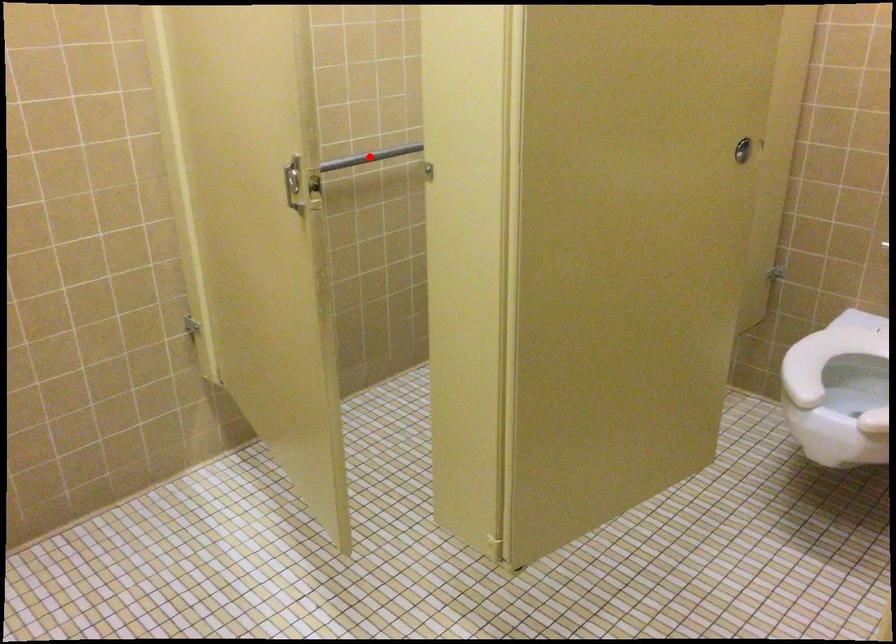
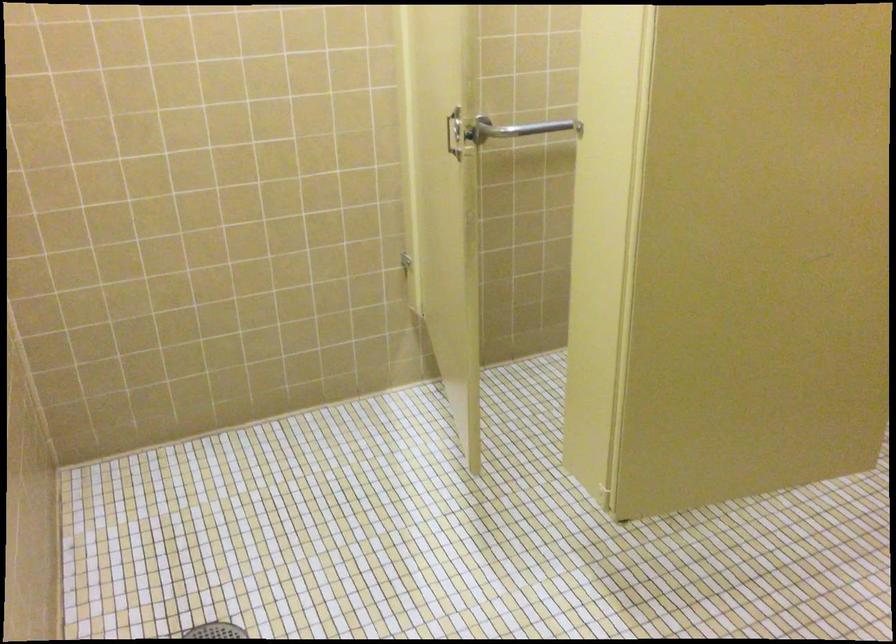
In the second image, find the point that corresponds to the highlighted location in the first image.

(590, 122)